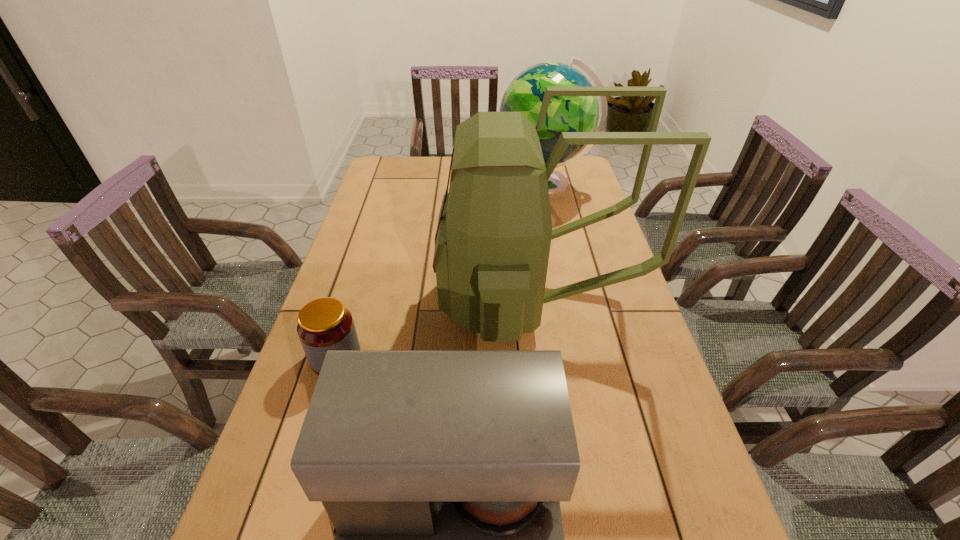
In order to click on backpack in this screenshot , I will do `click(492, 243)`.

At what (x,y) coordinates should I click in order to perform the action: click on the farthest object. Please return your answer as a coordinate pair (x, y). This screenshot has height=540, width=960. Looking at the image, I should click on coord(525,94).

Locate an element on the screen. The width and height of the screenshot is (960, 540). jar is located at coordinates (324, 324).

I want to click on the leftmost object, so click(324, 324).

You are a GUI agent. You are given a task and a screenshot of the screen. Output one action in this format:
    pyautogui.click(x=<x>, y=<y>)
    Task: Click on the free space located 0.270m on the front pocket of the backpack
    The height and width of the screenshot is (540, 960).
    Given the screenshot: What is the action you would take?
    pyautogui.click(x=340, y=301)

Where is `free spot located on the front pocket of the backpack`? free spot located on the front pocket of the backpack is located at coordinates (403, 301).

Identify the location of free space located 0.120m on the front pocket of the backpack. (396, 301).

Image resolution: width=960 pixels, height=540 pixels. In order to click on free point located on the front surface of the globe in this screenshot , I will do `click(431, 187)`.

The width and height of the screenshot is (960, 540). In order to click on free region located on the front surface of the globe in this screenshot , I will do (396, 187).

The image size is (960, 540). In order to click on vacant space located on the front surface of the globe in this screenshot , I will do `click(418, 187)`.